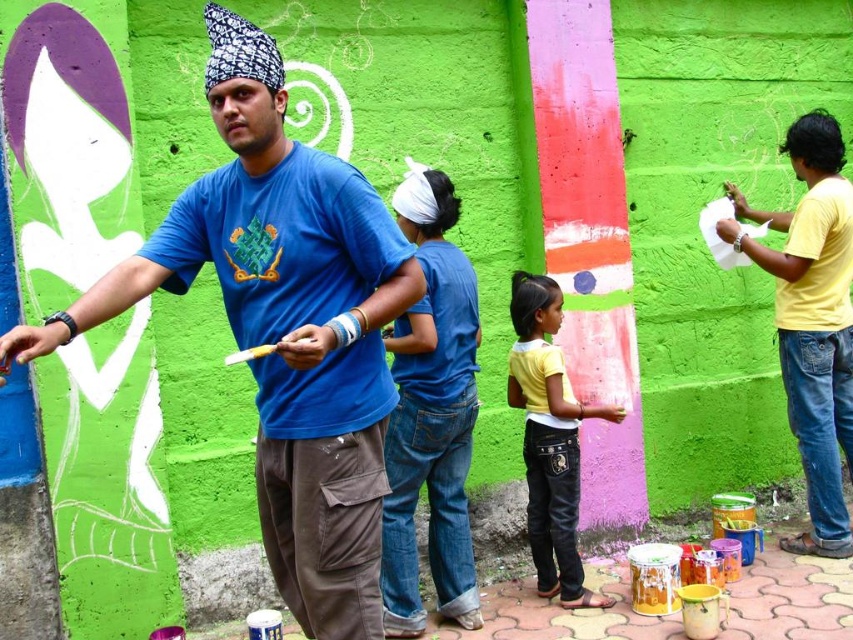
Question: Which of the following is the farthest from the observer?

Choices:
 (A) (836, 204)
 (B) (456, 508)

Answer: (A)

Question: Does blue t-shirt at center have a larger size compared to yellow cotton shirt at center?

Choices:
 (A) yes
 (B) no

Answer: (A)

Question: Can you confirm if denim jeans at center is smaller than yellow matte shirt at right?

Choices:
 (A) no
 (B) yes

Answer: (B)

Question: Does denim jeans at center have a lesser width compared to yellow cotton shirt at center?

Choices:
 (A) yes
 (B) no

Answer: (A)

Question: Which point is closer to the camera taking this photo?

Choices:
 (A) (569, 388)
 (B) (819, 336)

Answer: (A)

Question: Considering the real-world distances, which object is closest to the yellow matte shirt at right?

Choices:
 (A) blue t-shirt at center
 (B) denim jeans at center
 (C) yellow cotton shirt at center

Answer: (C)